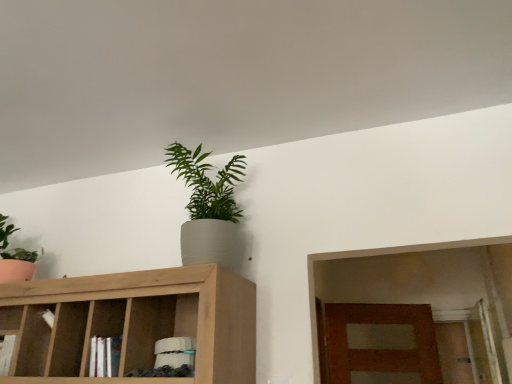
Question: Is point (226, 163) closer or farther from the camera than point (201, 374)?

Choices:
 (A) closer
 (B) farther

Answer: (B)

Question: From a real-world perspective, relative to light brown wood cabinet at upper center, is green matte plant at upper center, which appears as the second houseplant when viewed from the left, vertically above or below?

Choices:
 (A) above
 (B) below

Answer: (A)

Question: Considering the real-world distances, which object is closest to the matte green plant at left, the first houseplant when ordered from left to right?

Choices:
 (A) light brown wood cabinet at upper center
 (B) green matte plant at upper center, which is counted as the first houseplant, starting from the right

Answer: (A)

Question: Which of these objects is positioned farthest from the light brown wood cabinet at upper center?

Choices:
 (A) green matte plant at upper center, which appears as the second houseplant when viewed from the left
 (B) matte green plant at left, the first houseplant when ordered from left to right

Answer: (B)